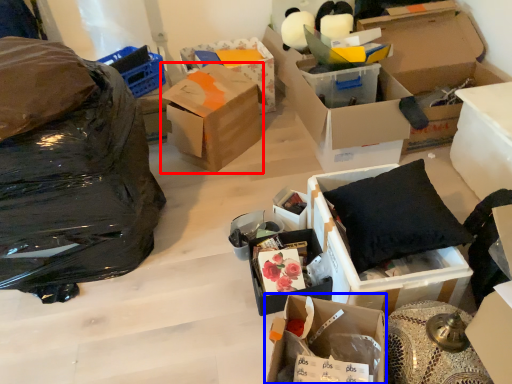
Question: Which object appears farthest to the camera in this image, box (highlighted by a red box) or box (highlighted by a blue box)?

Choices:
 (A) box
 (B) box

Answer: (A)